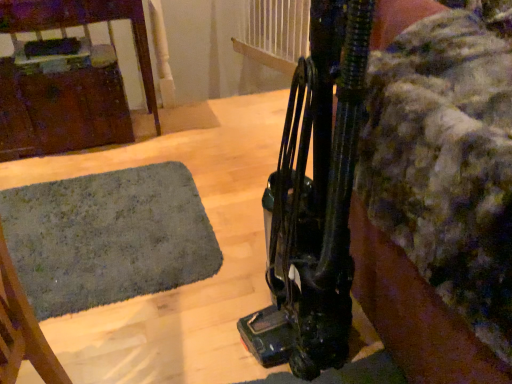
Question: Is dark green carpet at lower left inside or outside of brushed metal cabinet at left?

Choices:
 (A) outside
 (B) inside

Answer: (A)

Question: From a real-world perspective, is dark green carpet at lower left positioned above or below brushed metal cabinet at left?

Choices:
 (A) above
 (B) below

Answer: (B)

Question: Which of these objects is positioned farthest from the dark green carpet at lower left?

Choices:
 (A) brushed metal cabinet at left
 (B) black rubber vacuum cleaner at right

Answer: (B)

Question: Which object is the closest to the black rubber vacuum cleaner at right?

Choices:
 (A) brushed metal cabinet at left
 (B) dark green carpet at lower left

Answer: (B)